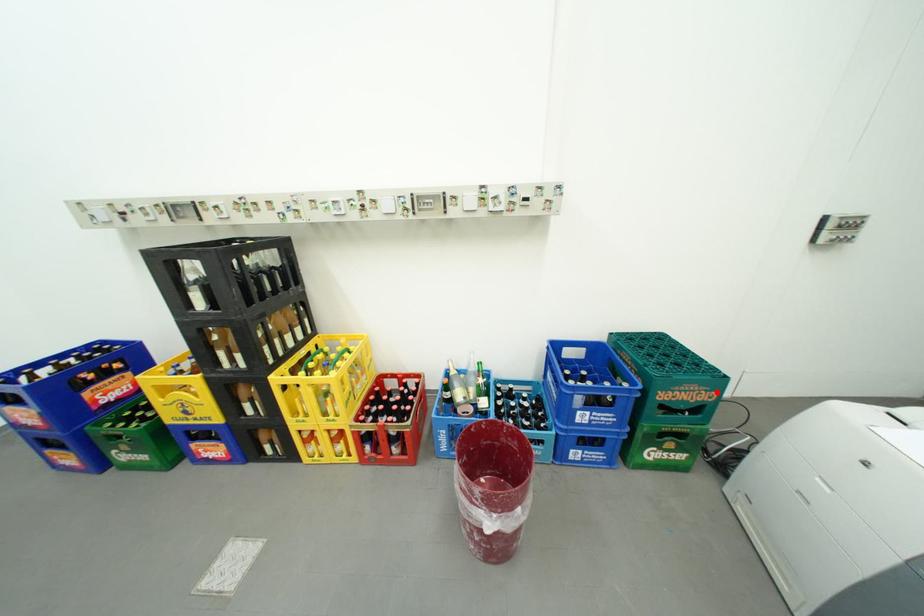
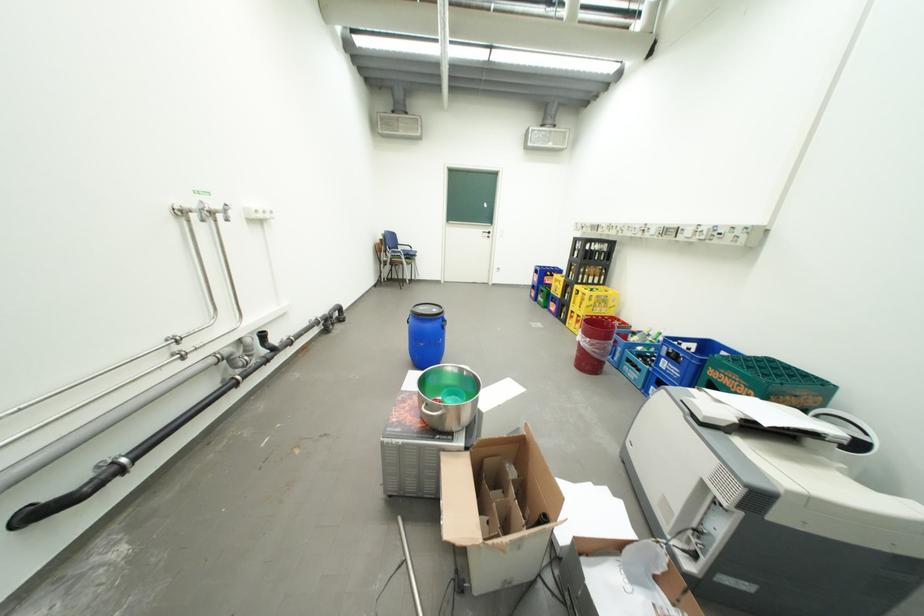
Locate, in the second image, the point that corresponds to the highlighted location in the first image.

(756, 387)